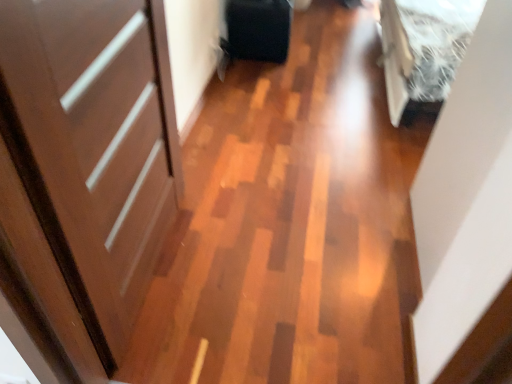
Identify the location of free point to the right of matte black suitcase at center. (313, 49).